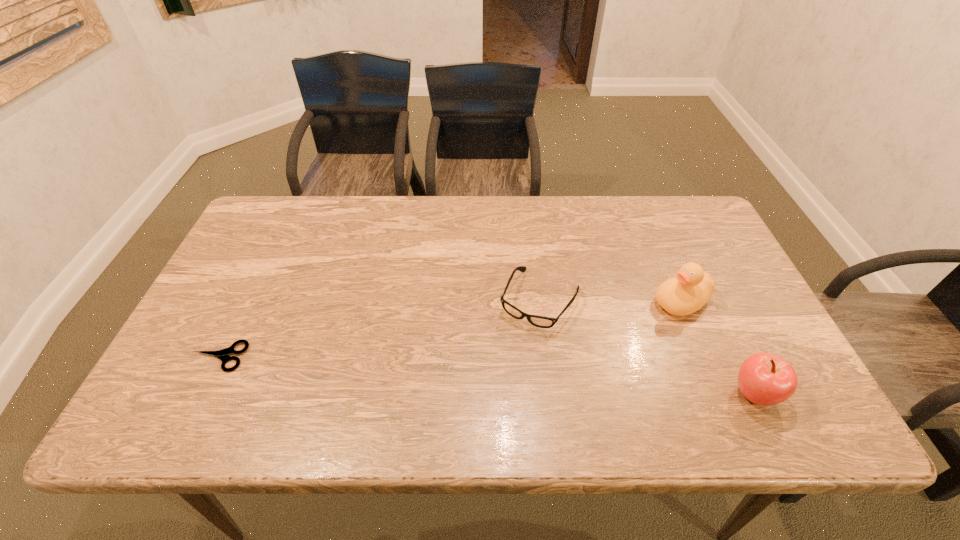
At what (x,y) coordinates should I click in order to perform the action: click on the leftmost object. Please return your answer as a coordinate pair (x, y). The image size is (960, 540). Looking at the image, I should click on (221, 354).

Find the location of a particular element. the second nearest object is located at coordinates coord(221,354).

Where is `apple`? The height and width of the screenshot is (540, 960). apple is located at coordinates (765, 379).

You are a GUI agent. You are given a task and a screenshot of the screen. Output one action in this format:
    pyautogui.click(x=<x>, y=<y>)
    Task: Click on the duck
    
    Given the screenshot: What is the action you would take?
    pyautogui.click(x=691, y=288)

I want to click on the third tallest object, so click(x=539, y=321).

Where is `the second object from left to right`? The image size is (960, 540). the second object from left to right is located at coordinates (539, 321).

Find the location of a particular element. The width and height of the screenshot is (960, 540). vacant area located 0.370m on the back of the third farthest object is located at coordinates (276, 241).

Where is `vacant space located on the left of the apple`? This screenshot has height=540, width=960. vacant space located on the left of the apple is located at coordinates (667, 394).

The image size is (960, 540). What are the coordinates of `free space located 0.250m on the face of the duck` in the screenshot? It's located at (582, 350).

Identify the location of vacant space located on the face of the duck. The height and width of the screenshot is (540, 960). (537, 373).